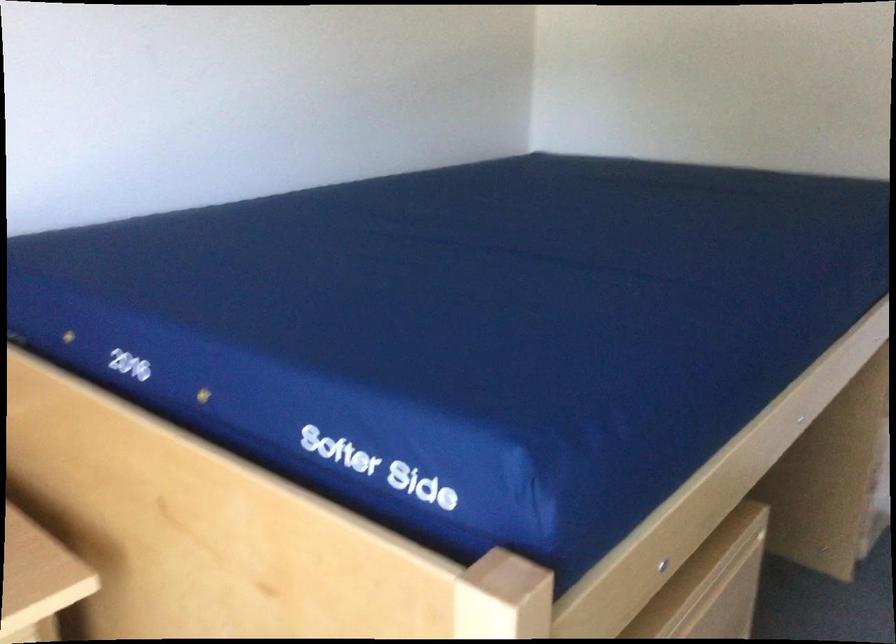
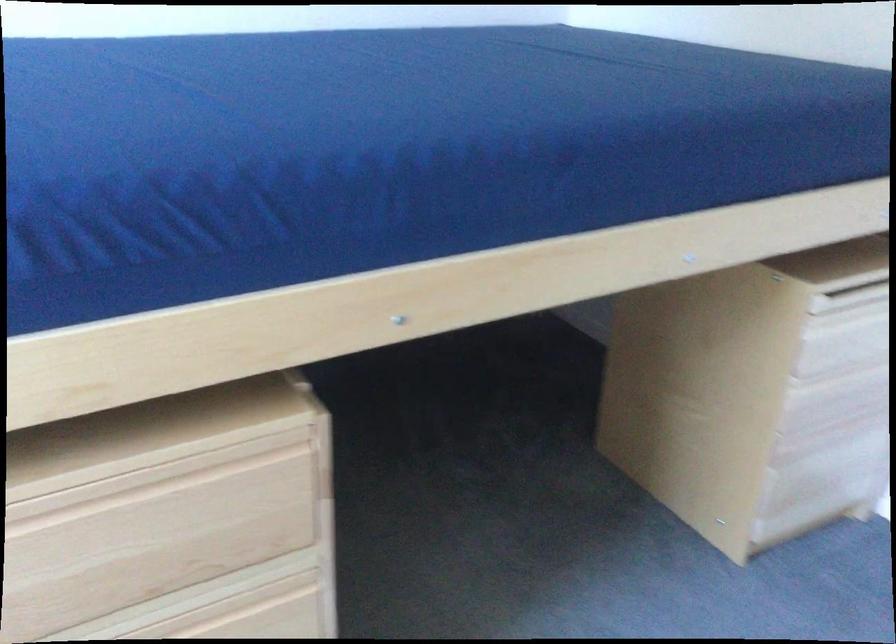
The images are taken continuously from a first-person perspective. In which direction are you moving?

The cameraman moved toward right, forward.